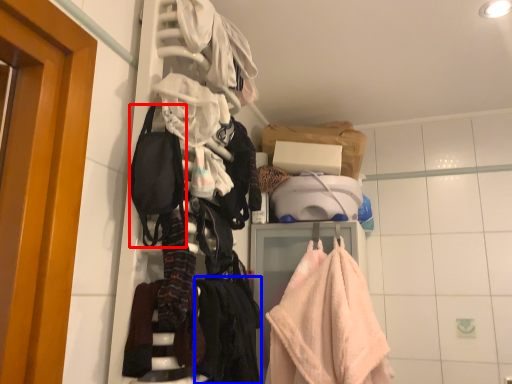
Question: Which object is further to the camera taking this photo, accessory (highlighted by a red box) or clothing (highlighted by a blue box)?

Choices:
 (A) accessory
 (B) clothing

Answer: (B)